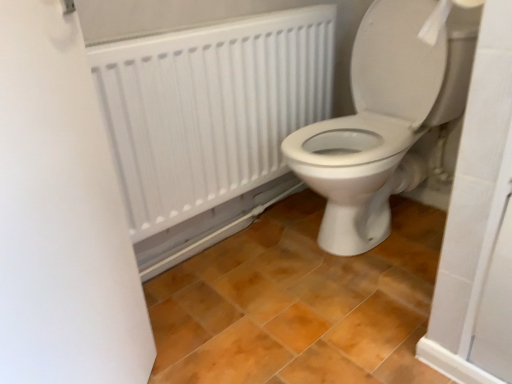
Question: Does white glossy toilet at center have a greater width compared to brown matte tile at center?

Choices:
 (A) no
 (B) yes

Answer: (A)

Question: Is white glossy toilet at center positioned behind brown matte tile at center?

Choices:
 (A) yes
 (B) no

Answer: (A)

Question: Is white glossy toilet at center positioned with its back to brown matte tile at center?

Choices:
 (A) yes
 (B) no

Answer: (B)

Question: From the image's perspective, is white glossy toilet at center above brown matte tile at center?

Choices:
 (A) no
 (B) yes

Answer: (B)

Question: Considering the relative sizes of white glossy toilet at center and brown matte tile at center in the image provided, is white glossy toilet at center thinner than brown matte tile at center?

Choices:
 (A) yes
 (B) no

Answer: (A)

Question: From a real-world perspective, relative to white glossy toilet at center, is white matte screen door at left vertically above or below?

Choices:
 (A) below
 (B) above

Answer: (B)

Question: From the image's perspective, relative to white glossy toilet at center, is white matte screen door at left above or below?

Choices:
 (A) above
 (B) below

Answer: (B)

Question: Is white matte screen door at left taller or shorter than white glossy toilet at center?

Choices:
 (A) tall
 (B) short

Answer: (A)

Question: Looking at their shapes, would you say white matte screen door at left is wider or thinner than white glossy toilet at center?

Choices:
 (A) wide
 (B) thin

Answer: (B)

Question: Visually, is white matte radiator at upper center positioned to the left or to the right of white paper at upper right?

Choices:
 (A) left
 (B) right

Answer: (A)

Question: From the image's perspective, is white matte radiator at upper center positioned above or below white paper at upper right?

Choices:
 (A) above
 (B) below

Answer: (B)

Question: Is white matte radiator at upper center bigger or smaller than white paper at upper right?

Choices:
 (A) big
 (B) small

Answer: (A)

Question: Is white matte radiator at upper center wider or thinner than white paper at upper right?

Choices:
 (A) wide
 (B) thin

Answer: (B)

Question: Is white glossy toilet at center wider or thinner than brown matte tile at center?

Choices:
 (A) wide
 (B) thin

Answer: (B)

Question: From their relative heights in the image, would you say white glossy toilet at center is taller or shorter than brown matte tile at center?

Choices:
 (A) tall
 (B) short

Answer: (A)